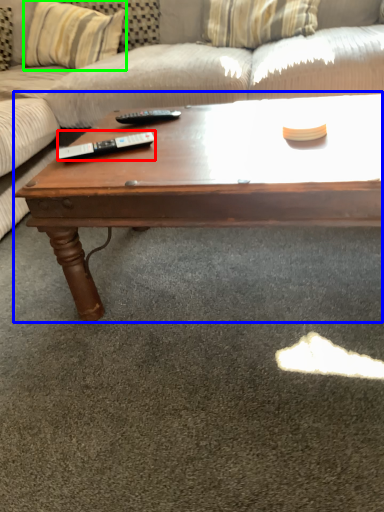
Question: Estimate the real-world distances between objects in this image. Which object is farther from remote (highlighted by a red box), coffee table (highlighted by a blue box) or pillow (highlighted by a green box)?

Choices:
 (A) coffee table
 (B) pillow

Answer: (B)